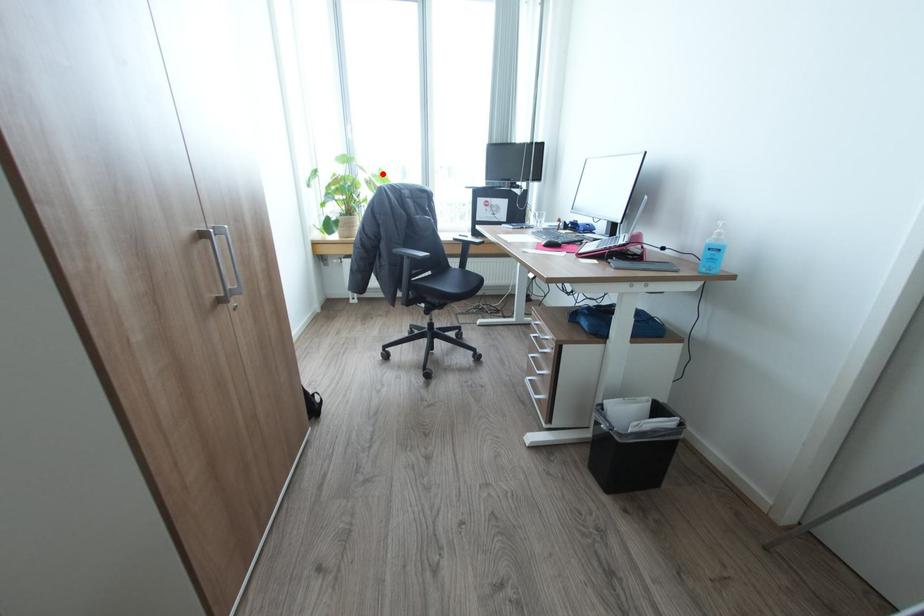
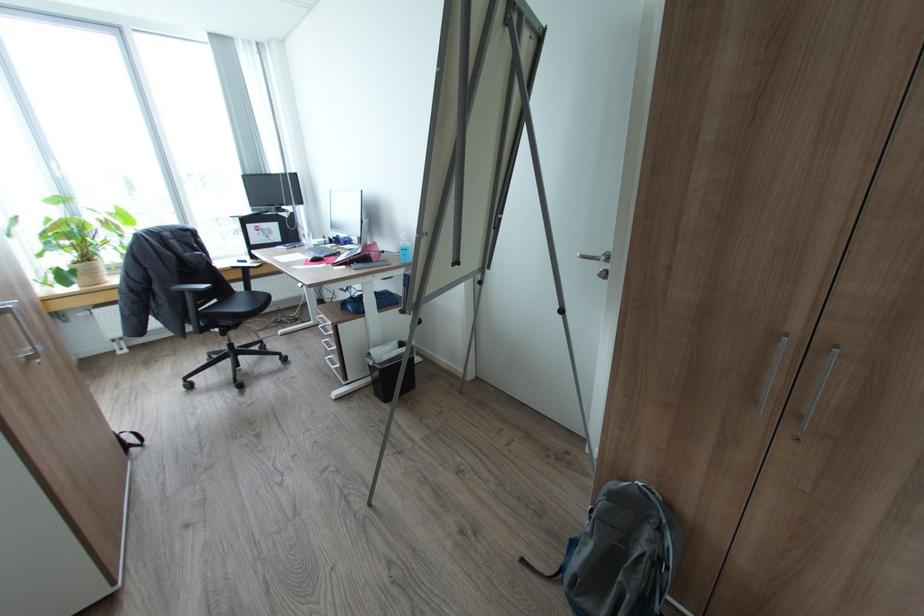
Question: I am providing you with two images of the same scene from different viewpoints. In image1, a red point is highlighted. Considering the same 3D point in image2, which of the following is correct?

Choices:
 (A) It is closer
 (B) It is farther

Answer: (B)